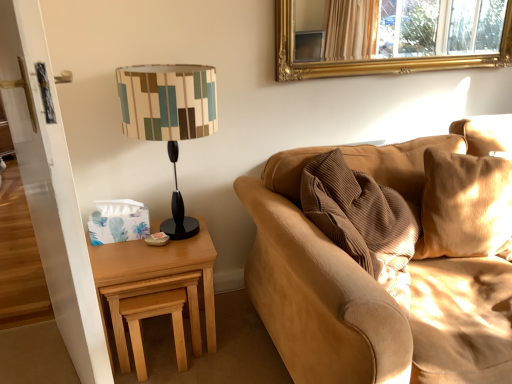
Question: From a real-world perspective, is matte black lampshade at left above or below light brown wood stool at lower left?

Choices:
 (A) above
 (B) below

Answer: (A)

Question: In terms of height, does matte black lampshade at left look taller or shorter compared to light brown wood stool at lower left?

Choices:
 (A) tall
 (B) short

Answer: (A)

Question: Which object is the closest to the corduroy fabric couch at right?

Choices:
 (A) matte black lampshade at left
 (B) light brown wood at left
 (C) beige suede pillow at right
 (D) gold ornate mirror at upper center
 (E) light brown wood stool at lower left

Answer: (C)

Question: Which is nearer to the light brown wood at left?

Choices:
 (A) beige suede pillow at right
 (B) gold ornate mirror at upper center
 (C) matte black lampshade at left
 (D) corduroy fabric couch at right
 (E) light brown wood stool at lower left

Answer: (E)